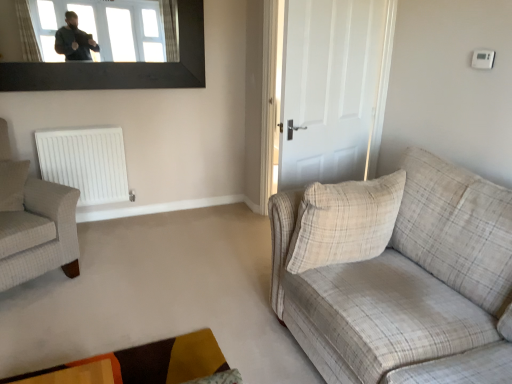
Question: Considering the positions of point (118, 49) and point (2, 180), is point (118, 49) closer or farther from the camera than point (2, 180)?

Choices:
 (A) closer
 (B) farther

Answer: (B)

Question: Based on their sizes in the image, would you say transparent glass window at upper center is bigger or smaller than beige plaid pillow at left, the 2th pillow from the right?

Choices:
 (A) big
 (B) small

Answer: (A)

Question: Based on their relative distances, which object is farther from the beige plaid fabric couch at right?

Choices:
 (A) transparent glass window at upper center
 (B) plaid fabric armchair at left
 (C) velvet-like brown and orange rug at lower center
 (D) beige plaid pillow at right, placed as the second pillow when sorted from left to right
 (E) beige plaid pillow at left, positioned as the second pillow in front-to-back order

Answer: (A)

Question: Which of these objects is positioned closest to the white matte radiator at left?

Choices:
 (A) plaid fabric armchair at left
 (B) beige plaid pillow at right, placed as the first pillow when sorted from front to back
 (C) velvet-like brown and orange rug at lower center
 (D) beige plaid fabric couch at right
 (E) transparent glass window at upper center

Answer: (A)